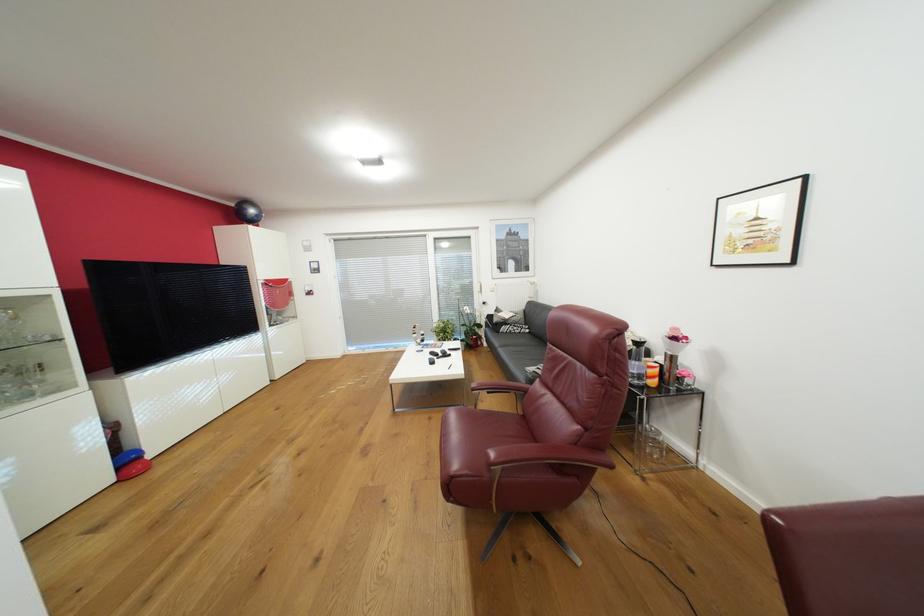
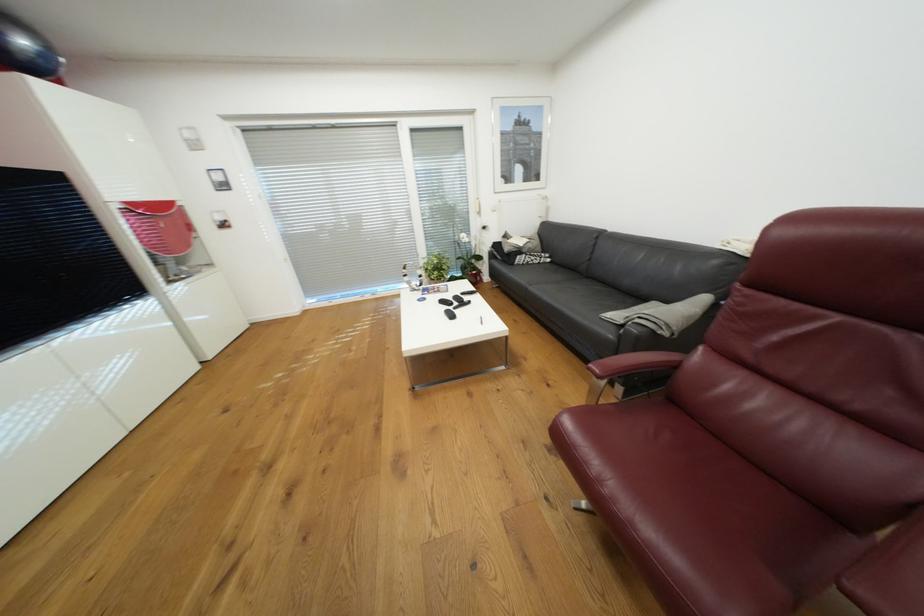
Locate, in the second image, the point that corresponds to (x=430, y=339) in the first image.

(427, 284)